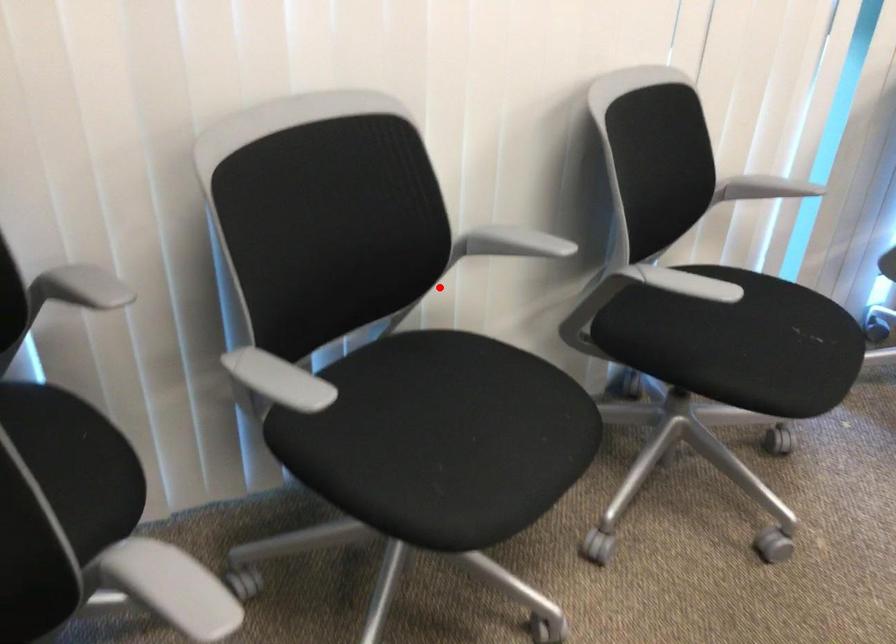
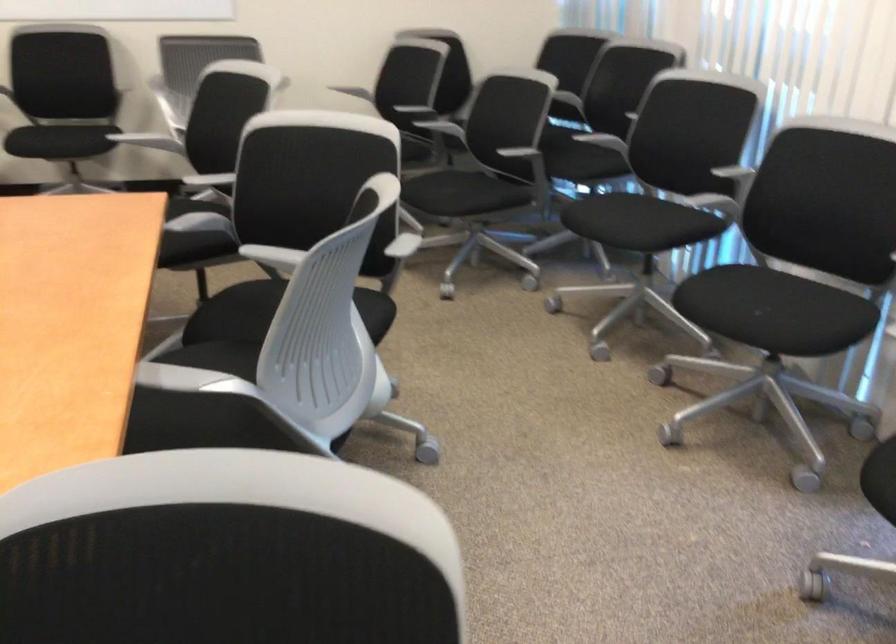
Question: I am providing you with two images of the same scene from different viewpoints. Image1 has a red point marked. In image2, the corresponding 3D location appears at what relative position? Reply with the corresponding letter.

Choices:
 (A) Closer
 (B) Farther

Answer: (B)